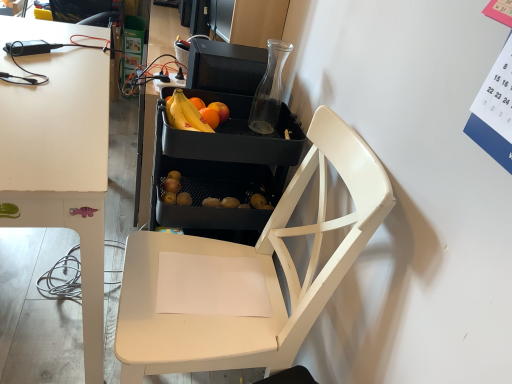
Question: Does white matte chair at center have a greater width compared to black plastic tray at center?

Choices:
 (A) no
 (B) yes

Answer: (B)

Question: Does white matte chair at center come behind black plastic tray at center?

Choices:
 (A) no
 (B) yes

Answer: (A)

Question: Is white matte chair at center closer to the viewer compared to black plastic tray at center?

Choices:
 (A) yes
 (B) no

Answer: (A)

Question: Does white matte chair at center appear on the right side of black plastic tray at center?

Choices:
 (A) no
 (B) yes

Answer: (B)

Question: Would you say white matte chair at center is a long distance from black plastic tray at center?

Choices:
 (A) no
 (B) yes

Answer: (A)

Question: Considering the relative sizes of white matte chair at center and black plastic tray at center in the image provided, is white matte chair at center smaller than black plastic tray at center?

Choices:
 (A) no
 (B) yes

Answer: (B)

Question: From the image's perspective, is matte black fruit at center on top of black plastic tray at center?

Choices:
 (A) yes
 (B) no

Answer: (B)

Question: Is matte black fruit at center bigger than black plastic tray at center?

Choices:
 (A) yes
 (B) no

Answer: (B)

Question: Does matte black fruit at center come in front of black plastic tray at center?

Choices:
 (A) yes
 (B) no

Answer: (A)

Question: Considering the relative sizes of matte black fruit at center and black plastic tray at center in the image provided, is matte black fruit at center taller than black plastic tray at center?

Choices:
 (A) yes
 (B) no

Answer: (B)

Question: From the image's perspective, does matte black fruit at center appear lower than black plastic tray at center?

Choices:
 (A) yes
 (B) no

Answer: (A)

Question: Is matte black fruit at center in contact with black plastic tray at center?

Choices:
 (A) no
 (B) yes

Answer: (A)

Question: Is white matte chair at center further to the viewer compared to matte black fruit at center?

Choices:
 (A) yes
 (B) no

Answer: (B)